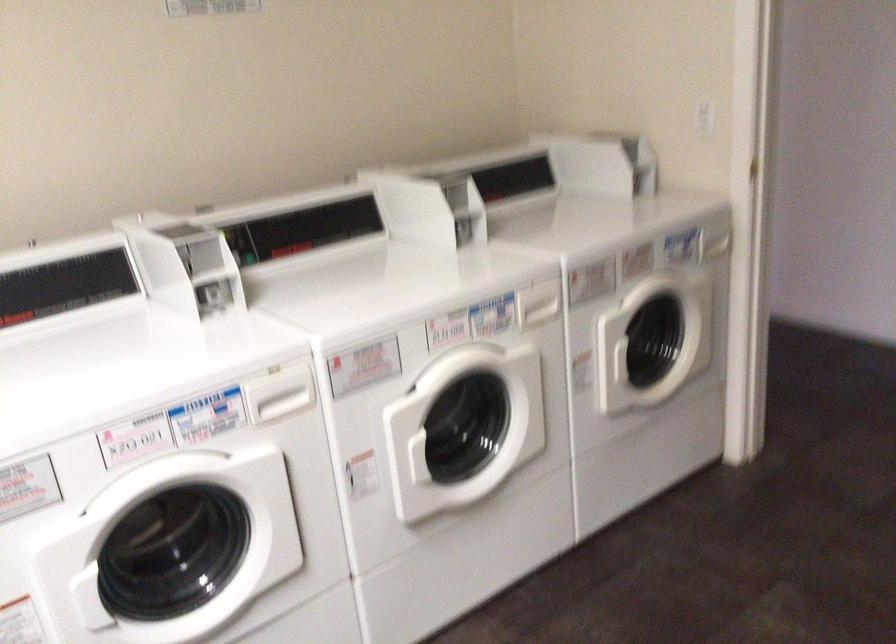
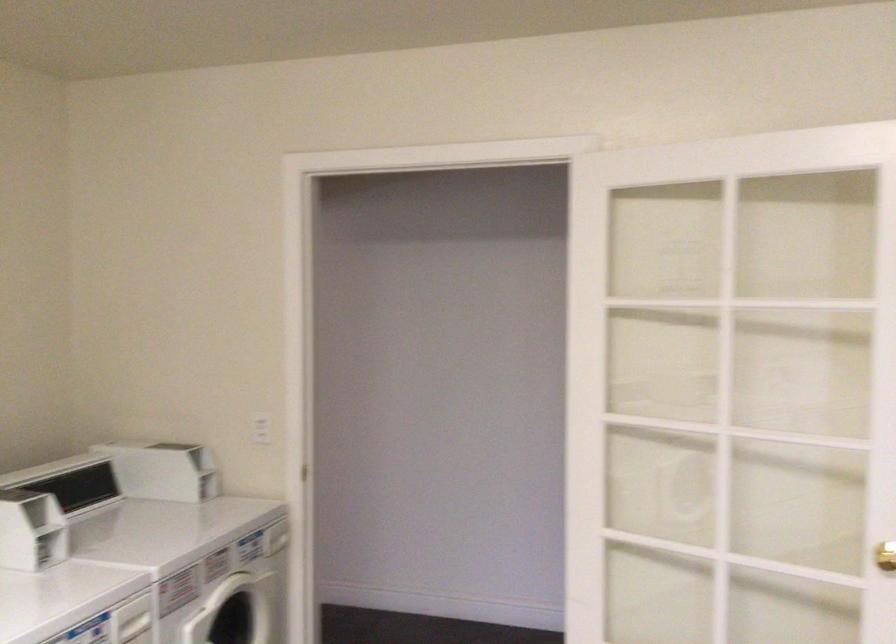
Locate, in the second image, the point that corresponds to point (436, 216) in the first image.

(30, 529)